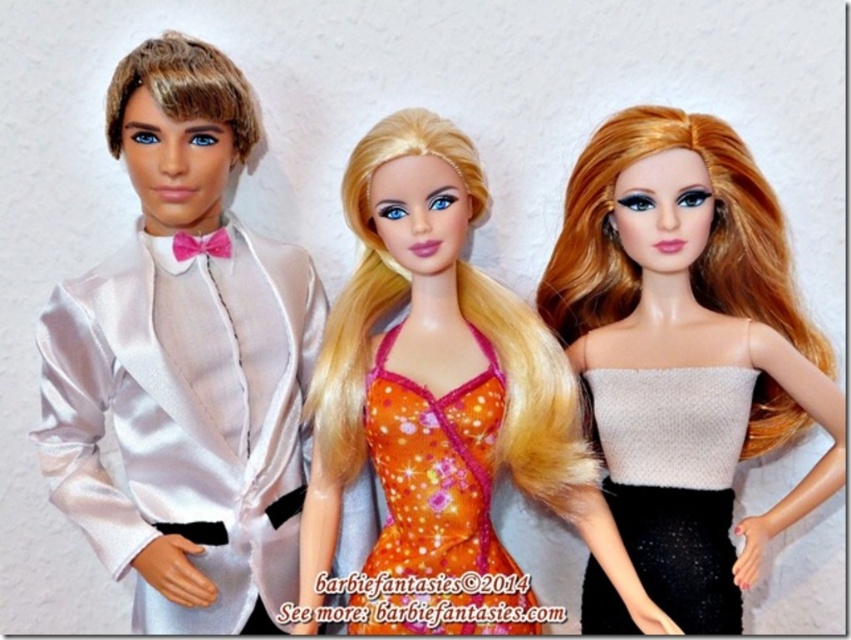
You are standing at the position of the point marked at coordinates (301,490) in the image. You want to take a photo of the three dolls arranged side by side. Will you be able to capture all three dolls in your camera frame if your camera has a 60 degree field of view?

The point marked at coordinates (301,490) is 4.53 feet away from the viewer. To determine if all three dolls can be captured in a 60 degree field of view, we need to calculate the angular width they occupy. However, without knowing the actual size of the dolls or the distance between them, it is impossible to definitively confirm. The answer would depend on those specific measurements which are not provided in the given information.

You are a photographer setting up a camera to take a closeup shot of the doll on the right. You need to focus on the point that is closer to you. Which point should you choose between point (640, 608) and point (680, 449)?

Point (640, 608) is closer to the viewer than point (680, 449), so you should focus on point (640, 608).